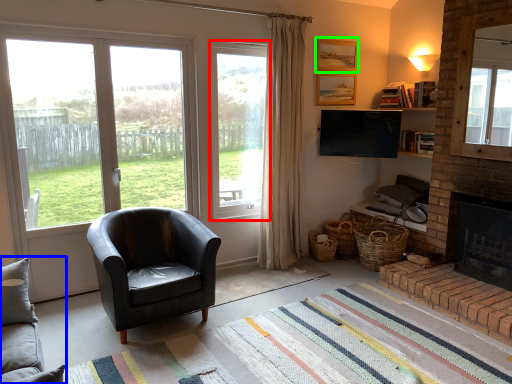
Question: Considering the real-world distances, which object is farthest from window (highlighted by a red box)? studio couch (highlighted by a blue box) or picture frame (highlighted by a green box)?

Choices:
 (A) studio couch
 (B) picture frame

Answer: (A)